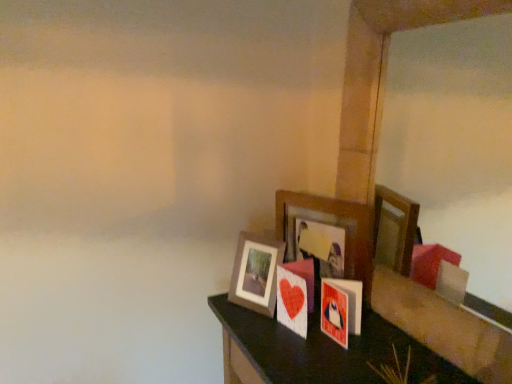
What do you see at coordinates (334, 225) in the screenshot?
I see `wooden picture frame at center, acting as the 2th picture frame starting from the left` at bounding box center [334, 225].

This screenshot has width=512, height=384. In order to click on wooden picture frame at center, the first picture frame viewed from the right in this screenshot , I will do `click(334, 225)`.

What do you see at coordinates (256, 273) in the screenshot? The image size is (512, 384). I see `wooden photo frame at center, the 2th picture frame positioned from the right` at bounding box center [256, 273].

What is the approximate width of wooden photo frame at center, the 2th picture frame positioned from the right?

wooden photo frame at center, the 2th picture frame positioned from the right, is 3.65 inches wide.

Where is `wooden photo frame at center, the first picture frame in the left-to-right sequence`? The height and width of the screenshot is (384, 512). wooden photo frame at center, the first picture frame in the left-to-right sequence is located at coordinates (256, 273).

Locate an element on the screen. The height and width of the screenshot is (384, 512). wooden picture frame at center, the first picture frame viewed from the right is located at coordinates (334, 225).

Considering the relative positions of wooden picture frame at center, the first picture frame viewed from the right, and wooden photo frame at center, the 2th picture frame positioned from the right, in the image provided, is wooden picture frame at center, the first picture frame viewed from the right, to the left or to the right of wooden photo frame at center, the 2th picture frame positioned from the right,?

wooden picture frame at center, the first picture frame viewed from the right, is to the right of wooden photo frame at center, the 2th picture frame positioned from the right.

Which object is further away from the camera taking this photo, wooden picture frame at center, acting as the 2th picture frame starting from the left, or wooden photo frame at center, the 2th picture frame positioned from the right?

wooden photo frame at center, the 2th picture frame positioned from the right, is further away from the camera.

Is point (361, 227) in front of point (272, 312)?

That is True.

From the image's perspective, which is above, wooden picture frame at center, the first picture frame viewed from the right, or wooden photo frame at center, the first picture frame in the left-to-right sequence?

wooden picture frame at center, the first picture frame viewed from the right, is shown above in the image.

From a real-world perspective, relative to wooden photo frame at center, the first picture frame in the left-to-right sequence, is wooden picture frame at center, acting as the 2th picture frame starting from the left, vertically above or below?

wooden picture frame at center, acting as the 2th picture frame starting from the left, is above wooden photo frame at center, the first picture frame in the left-to-right sequence.

Between wooden picture frame at center, the first picture frame viewed from the right, and wooden photo frame at center, the 2th picture frame positioned from the right, which one has larger width?

Wider between the two is wooden photo frame at center, the 2th picture frame positioned from the right.

Who is taller, wooden picture frame at center, the first picture frame viewed from the right, or wooden photo frame at center, the 2th picture frame positioned from the right?

wooden picture frame at center, the first picture frame viewed from the right.

Between wooden picture frame at center, the first picture frame viewed from the right, and wooden photo frame at center, the first picture frame in the left-to-right sequence, which one has larger size?

With larger size is wooden picture frame at center, the first picture frame viewed from the right.

Is wooden picture frame at center, the first picture frame viewed from the right, spatially inside wooden photo frame at center, the 2th picture frame positioned from the right, or outside of it?

wooden picture frame at center, the first picture frame viewed from the right, lies outside wooden photo frame at center, the 2th picture frame positioned from the right.

Is wooden picture frame at center, acting as the 2th picture frame starting from the left, not close to wooden photo frame at center, the 2th picture frame positioned from the right?

They are positioned close to each other.

Is wooden photo frame at center, the 2th picture frame positioned from the right, at the back of wooden picture frame at center, acting as the 2th picture frame starting from the left?

No, wooden picture frame at center, acting as the 2th picture frame starting from the left, is not facing away from wooden photo frame at center, the 2th picture frame positioned from the right.

Measure the distance from wooden picture frame at center, the first picture frame viewed from the right, to wooden photo frame at center, the 2th picture frame positioned from the right.

wooden picture frame at center, the first picture frame viewed from the right, is 9.65 inches from wooden photo frame at center, the 2th picture frame positioned from the right.

At what (x,y) coordinates should I click in order to perform the action: click on picture frame below the wooden picture frame at center, the first picture frame viewed from the right (from a real-world perspective). Please return your answer as a coordinate pair (x, y). Looking at the image, I should click on point(256,273).

Considering the relative positions of wooden photo frame at center, the 2th picture frame positioned from the right, and wooden picture frame at center, acting as the 2th picture frame starting from the left, in the image provided, is wooden photo frame at center, the 2th picture frame positioned from the right, to the right of wooden picture frame at center, acting as the 2th picture frame starting from the left, from the viewer's perspective?

No.

Which is behind, wooden photo frame at center, the first picture frame in the left-to-right sequence, or wooden picture frame at center, acting as the 2th picture frame starting from the left?

wooden photo frame at center, the first picture frame in the left-to-right sequence, is further away from the camera.

Which point is more forward, (268, 299) or (346, 247)?

Positioned in front is point (346, 247).

From the image's perspective, which object appears higher, wooden photo frame at center, the 2th picture frame positioned from the right, or wooden picture frame at center, the first picture frame viewed from the right?

wooden picture frame at center, the first picture frame viewed from the right.

From a real-world perspective, does wooden photo frame at center, the 2th picture frame positioned from the right, stand above wooden picture frame at center, the first picture frame viewed from the right?

No, from a real-world perspective, wooden photo frame at center, the 2th picture frame positioned from the right, is not over wooden picture frame at center, the first picture frame viewed from the right

Which of these two, wooden photo frame at center, the 2th picture frame positioned from the right, or wooden picture frame at center, acting as the 2th picture frame starting from the left, is thinner?

wooden picture frame at center, acting as the 2th picture frame starting from the left, is thinner.

Between wooden photo frame at center, the 2th picture frame positioned from the right, and wooden picture frame at center, acting as the 2th picture frame starting from the left, which one has more height?

With more height is wooden picture frame at center, acting as the 2th picture frame starting from the left.

Consider the image. Considering the relative sizes of wooden photo frame at center, the first picture frame in the left-to-right sequence, and wooden picture frame at center, the first picture frame viewed from the right, in the image provided, is wooden photo frame at center, the first picture frame in the left-to-right sequence, bigger than wooden picture frame at center, the first picture frame viewed from the right,?

No.

Is wooden picture frame at center, the first picture frame viewed from the right, completely or partially inside wooden photo frame at center, the first picture frame in the left-to-right sequence?

Definitely not — wooden picture frame at center, the first picture frame viewed from the right, is not inside wooden photo frame at center, the first picture frame in the left-to-right sequence.

Can you see wooden photo frame at center, the 2th picture frame positioned from the right, touching wooden picture frame at center, the first picture frame viewed from the right?

No, wooden photo frame at center, the 2th picture frame positioned from the right, is not beside wooden picture frame at center, the first picture frame viewed from the right.

Is wooden photo frame at center, the 2th picture frame positioned from the right, facing away from wooden picture frame at center, the first picture frame viewed from the right?

Yes, wooden picture frame at center, the first picture frame viewed from the right, is at the back of wooden photo frame at center, the 2th picture frame positioned from the right.

How different are the orientations of wooden photo frame at center, the first picture frame in the left-to-right sequence, and wooden picture frame at center, acting as the 2th picture frame starting from the left, in degrees?

The angular difference between wooden photo frame at center, the first picture frame in the left-to-right sequence, and wooden picture frame at center, acting as the 2th picture frame starting from the left, is 1.9 degrees.

I want to click on picture frame located below the wooden picture frame at center, acting as the 2th picture frame starting from the left (from the image's perspective), so point(256,273).

Image resolution: width=512 pixels, height=384 pixels. I want to click on picture frame in front of the wooden photo frame at center, the first picture frame in the left-to-right sequence, so click(x=334, y=225).

At what (x,y) coordinates should I click in order to perform the action: click on picture frame that is on the right side of wooden photo frame at center, the first picture frame in the left-to-right sequence. Please return your answer as a coordinate pair (x, y). The width and height of the screenshot is (512, 384). Looking at the image, I should click on (334, 225).